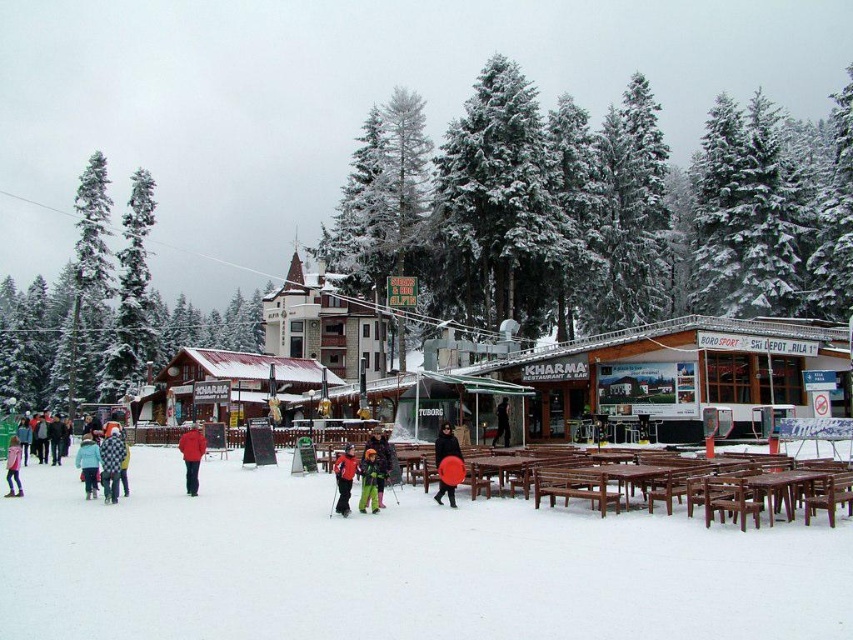
Which of these two, green matte tree at upper center or green snow-covered tree at left, stands shorter?

With less height is green snow-covered tree at left.

Is point (614, 189) farther from viewer compared to point (100, 380)?

That is False.

Describe the element at coordinates (633, 212) in the screenshot. The image size is (853, 640). I see `green matte tree at upper center` at that location.

You are a GUI agent. You are given a task and a screenshot of the screen. Output one action in this format:
    pyautogui.click(x=<x>, y=<y>)
    Task: Click on the green matte tree at upper center
    
    Given the screenshot: What is the action you would take?
    pyautogui.click(x=633, y=212)

Which of these two, green matte snow pants at center or matte red sled at center, stands taller?

matte red sled at center is taller.

Is green matte snow pants at center shorter than matte red sled at center?

Correct, green matte snow pants at center is not as tall as matte red sled at center.

Describe the element at coordinates (368, 481) in the screenshot. I see `green matte snow pants at center` at that location.

Locate an element on the screen. green matte snow pants at center is located at coordinates (368, 481).

Can you confirm if green snow-covered tree at left is positioned below matte red sled at center?

Incorrect, green snow-covered tree at left is not positioned below matte red sled at center.

Where is `green snow-covered tree at left`? This screenshot has width=853, height=640. green snow-covered tree at left is located at coordinates point(131,296).